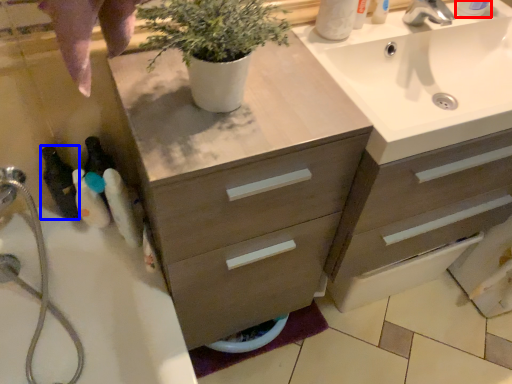
Question: Which of the following is the farthest to the observer, toiletry (highlighted by a red box) or toiletry (highlighted by a blue box)?

Choices:
 (A) toiletry
 (B) toiletry

Answer: (B)